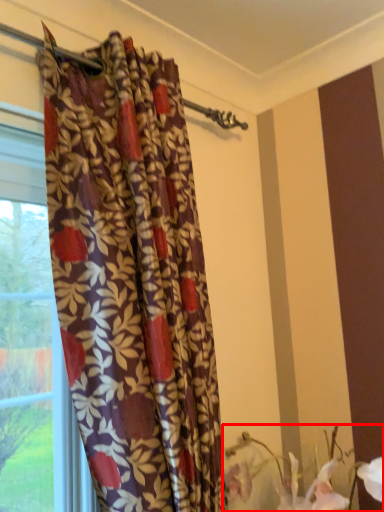
Question: From the image's perspective, what is the correct spatial positioning of floral arrangement (annotated by the red box) in reference to curtain?

Choices:
 (A) below
 (B) above

Answer: (A)